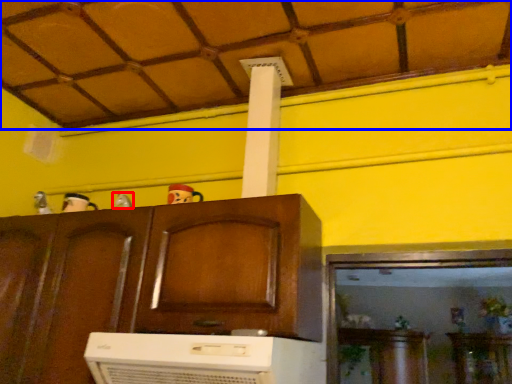
Question: Which point is closer to the camera, toy (highlighted by a red box) or tile roof (highlighted by a blue box)?

Choices:
 (A) toy
 (B) tile roof

Answer: (B)